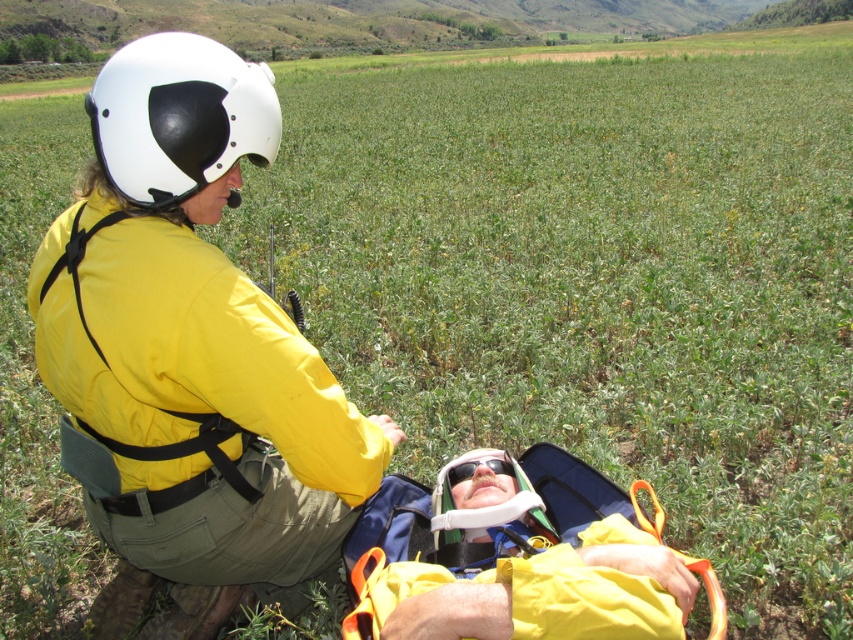
Is white matte helmet at upper left to the left of black plastic goggles at center from the viewer's perspective?

Yes, white matte helmet at upper left is to the left of black plastic goggles at center.

Is white matte helmet at upper left further to camera compared to black plastic goggles at center?

No, it is in front of black plastic goggles at center.

What do you see at coordinates (178, 116) in the screenshot? The height and width of the screenshot is (640, 853). I see `white matte helmet at upper left` at bounding box center [178, 116].

Where is `white matte helmet at upper left`? white matte helmet at upper left is located at coordinates (178, 116).

Between yellow fabric at center and black plastic goggles at center, which one has less height?

With less height is black plastic goggles at center.

Is point (442, 541) in front of point (456, 467)?

Yes, point (442, 541) is in front of point (456, 467).

The height and width of the screenshot is (640, 853). Identify the location of yellow fabric at center. (514, 560).

Can you confirm if yellow fabric at center is smaller than white matte helmet at upper left?

Actually, yellow fabric at center might be larger than white matte helmet at upper left.

Is point (352, 588) behind point (99, 138)?

Yes, it is behind point (99, 138).

The width and height of the screenshot is (853, 640). In order to click on yellow fabric at center in this screenshot , I will do `click(514, 560)`.